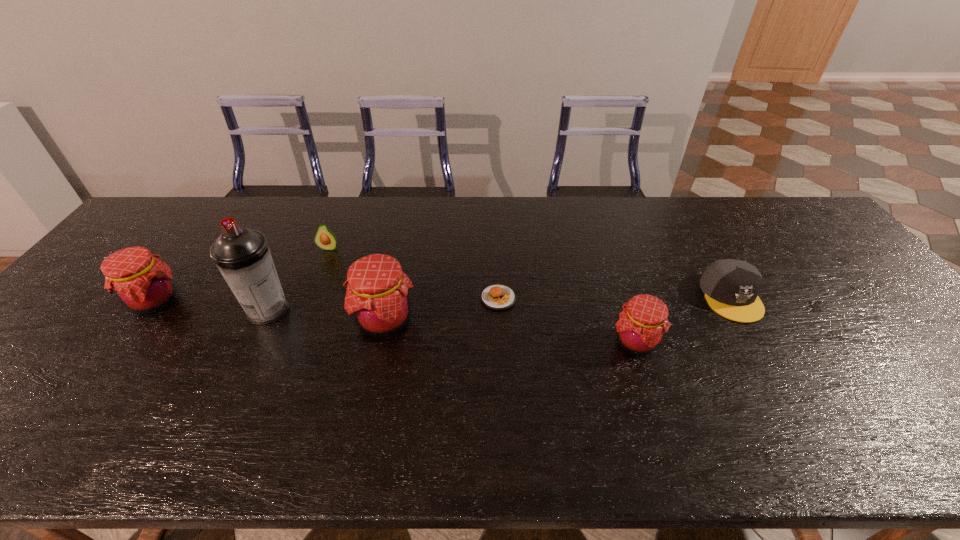
Identify the location of the second object from left to right. (242, 255).

You are a GUI agent. You are given a task and a screenshot of the screen. Output one action in this format:
    pyautogui.click(x=<x>, y=<y>)
    Task: Click on the aerosol can
    
    Given the screenshot: What is the action you would take?
    pyautogui.click(x=242, y=255)

Identify the location of vacant area located 0.060m on the front of the second shortest jam. This screenshot has width=960, height=540. (126, 340).

Where is `free space located 0.320m on the back of the second jam from right to left`? free space located 0.320m on the back of the second jam from right to left is located at coordinates (404, 227).

The height and width of the screenshot is (540, 960). What are the coordinates of `vacant region located 0.350m on the right of the fourth shortest object` in the screenshot? It's located at (802, 342).

The image size is (960, 540). Find the location of `vacant area situated 0.050m on the cut side of the avocado`. vacant area situated 0.050m on the cut side of the avocado is located at coordinates (323, 263).

Where is `free location located on the left of the food`? free location located on the left of the food is located at coordinates (459, 298).

I want to click on free space located on the front-facing side of the cap, so click(788, 395).

Find the location of `free space located on the front of the second object from left to right`. free space located on the front of the second object from left to right is located at coordinates (234, 381).

Find the location of a particular element. Image resolution: width=960 pixels, height=540 pixels. object located in the left edge section of the desktop is located at coordinates click(143, 284).